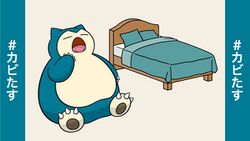
Find the location of `head  board`. head  board is located at coordinates (130, 22).